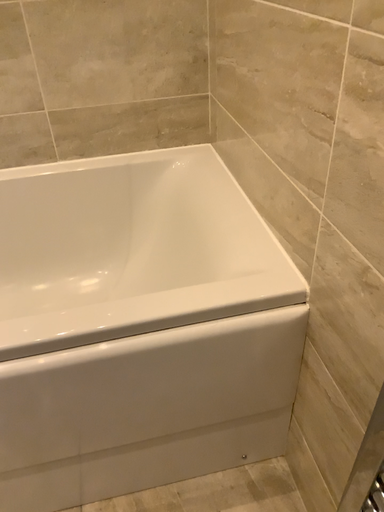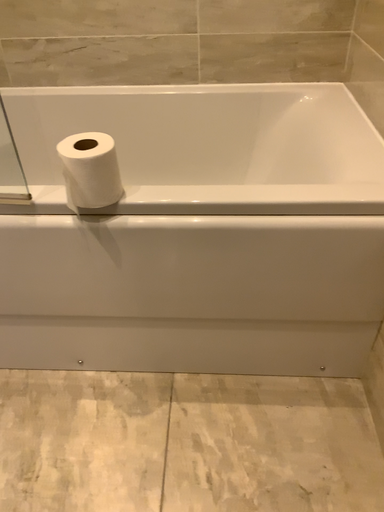
Question: Which way did the camera rotate in the video?

Choices:
 (A) rotated right
 (B) rotated left

Answer: (B)